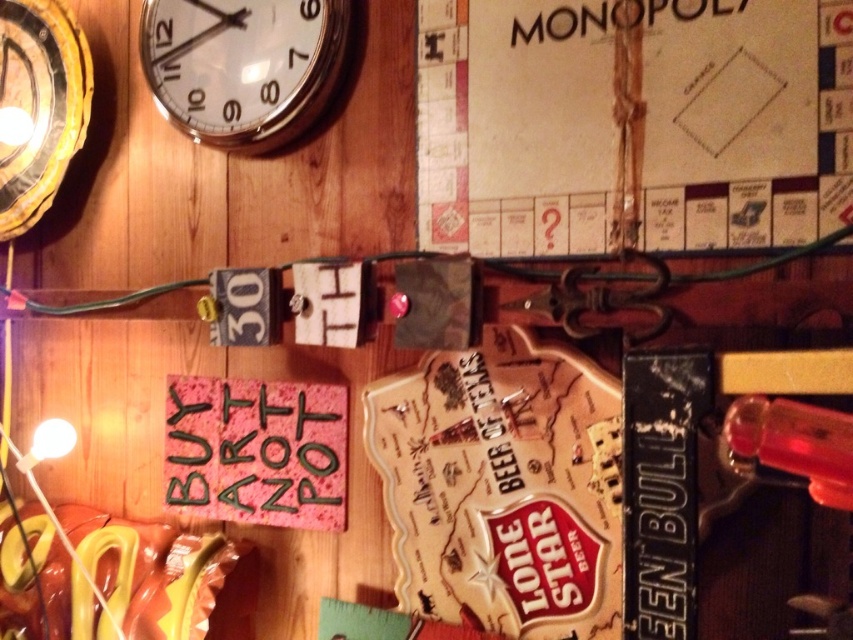
Is point (799, 237) closer to viewer compared to point (190, 17)?

That is True.

Can you confirm if wooden monopoly game at upper right is bigger than white glossy clock at upper left?

Correct, wooden monopoly game at upper right is larger in size than white glossy clock at upper left.

This screenshot has width=853, height=640. Describe the element at coordinates (631, 124) in the screenshot. I see `wooden monopoly game at upper right` at that location.

Locate an element on the screen. wooden monopoly game at upper right is located at coordinates (631, 124).